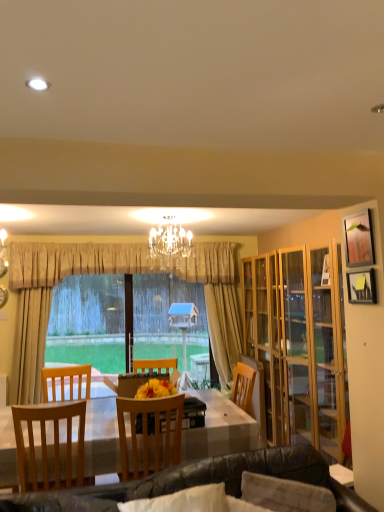
Question: Considering the relative sizes of light brown wooden chair at left, the 1th chair from the left, and beige fabric curtain at center in the image provided, is light brown wooden chair at left, the 1th chair from the left, thinner than beige fabric curtain at center?

Choices:
 (A) no
 (B) yes

Answer: (A)

Question: From a real-world perspective, is light brown wooden chair at left, the 2th chair when ordered from right to left, located beneath beige fabric curtain at center?

Choices:
 (A) yes
 (B) no

Answer: (A)

Question: Is light brown wooden chair at left, the 2th chair when ordered from right to left, taller than beige fabric curtain at center?

Choices:
 (A) yes
 (B) no

Answer: (B)

Question: Does light brown wooden chair at left, the 2th chair when ordered from right to left, lie in front of beige fabric curtain at center?

Choices:
 (A) yes
 (B) no

Answer: (A)

Question: Is light brown wooden chair at left, the 2th chair when ordered from right to left, placed right next to beige fabric curtain at center?

Choices:
 (A) no
 (B) yes

Answer: (A)

Question: Is light brown wooden chair at left, the 1th chair from the left, wider than beige fabric curtain at center?

Choices:
 (A) no
 (B) yes

Answer: (B)

Question: From a real-world perspective, is crystal chandelier at center positioned under beige fabric curtain at center based on gravity?

Choices:
 (A) yes
 (B) no

Answer: (B)

Question: Is crystal chandelier at center at the left side of beige fabric curtain at center?

Choices:
 (A) no
 (B) yes

Answer: (A)

Question: Can you confirm if crystal chandelier at center is wider than beige fabric curtain at center?

Choices:
 (A) no
 (B) yes

Answer: (B)

Question: From the image's perspective, would you say crystal chandelier at center is shown under beige fabric curtain at center?

Choices:
 (A) no
 (B) yes

Answer: (A)

Question: Can we say crystal chandelier at center lies outside beige fabric curtain at center?

Choices:
 (A) no
 (B) yes

Answer: (B)

Question: Is crystal chandelier at center touching beige fabric curtain at center?

Choices:
 (A) yes
 (B) no

Answer: (B)

Question: Are beige fabric curtain at center and leather couch at lower center beside each other?

Choices:
 (A) yes
 (B) no

Answer: (B)